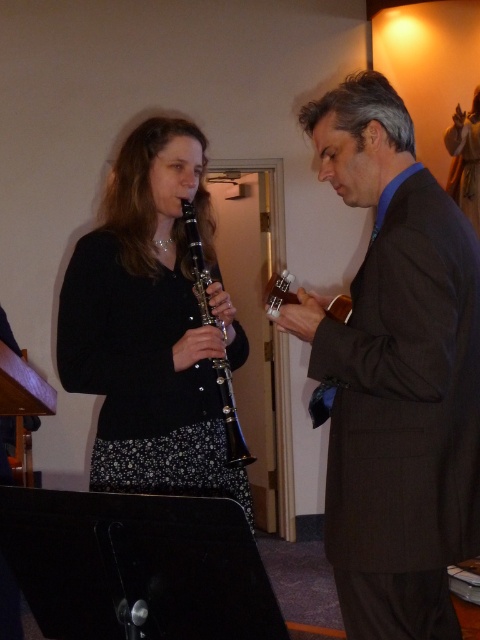
Question: Does brown wool suit at right have a smaller size compared to black glossy clarinet at center?

Choices:
 (A) yes
 (B) no

Answer: (A)

Question: Considering the real-world distances, which object is farthest from the black matte clarinet at center?

Choices:
 (A) black glossy clarinet at center
 (B) brown wool suit at right

Answer: (B)

Question: Is brown wool suit at right bigger than black glossy clarinet at center?

Choices:
 (A) no
 (B) yes

Answer: (A)

Question: Which object is closer to the camera taking this photo?

Choices:
 (A) brown wool suit at right
 (B) black glossy clarinet at center
 (C) black matte clarinet at center

Answer: (A)

Question: Where is brown wool suit at right located in relation to black matte clarinet at center in the image?

Choices:
 (A) above
 (B) below

Answer: (B)

Question: Which of these objects is positioned closest to the black glossy clarinet at center?

Choices:
 (A) brown wool suit at right
 (B) black matte clarinet at center

Answer: (B)